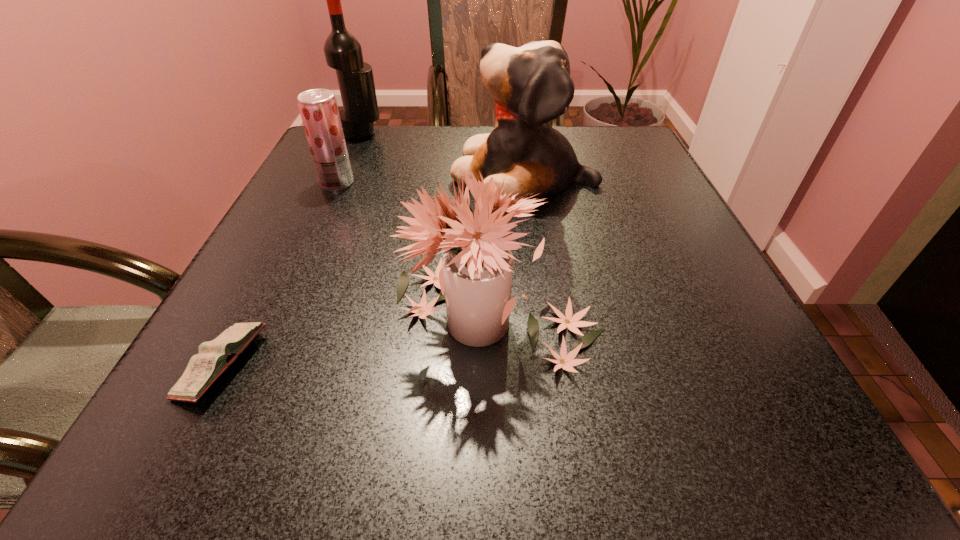
Locate an element on the screen. free space located 0.270m on the back of the bouquet is located at coordinates (492, 186).

Where is `free region located on the right of the fruit juice`? free region located on the right of the fruit juice is located at coordinates click(x=410, y=183).

Locate an element on the screen. free region located 0.370m on the right of the diary is located at coordinates (507, 365).

Find the location of a particular element. Image resolution: width=960 pixels, height=540 pixels. wine bottle that is at the far edge is located at coordinates (343, 52).

Find the location of a particular element. This screenshot has width=960, height=540. puppy that is positioned at the far edge is located at coordinates (531, 85).

Where is `object present at the near edge`? The height and width of the screenshot is (540, 960). object present at the near edge is located at coordinates (215, 356).

Locate an element on the screen. wine bottle that is at the left edge is located at coordinates (343, 52).

Locate an element on the screen. fruit juice located in the left edge section of the desktop is located at coordinates (318, 108).

Find the location of a particular element. The height and width of the screenshot is (540, 960). diary that is at the left edge is located at coordinates (215, 356).

The image size is (960, 540). I want to click on object located in the right edge section of the desktop, so click(531, 85).